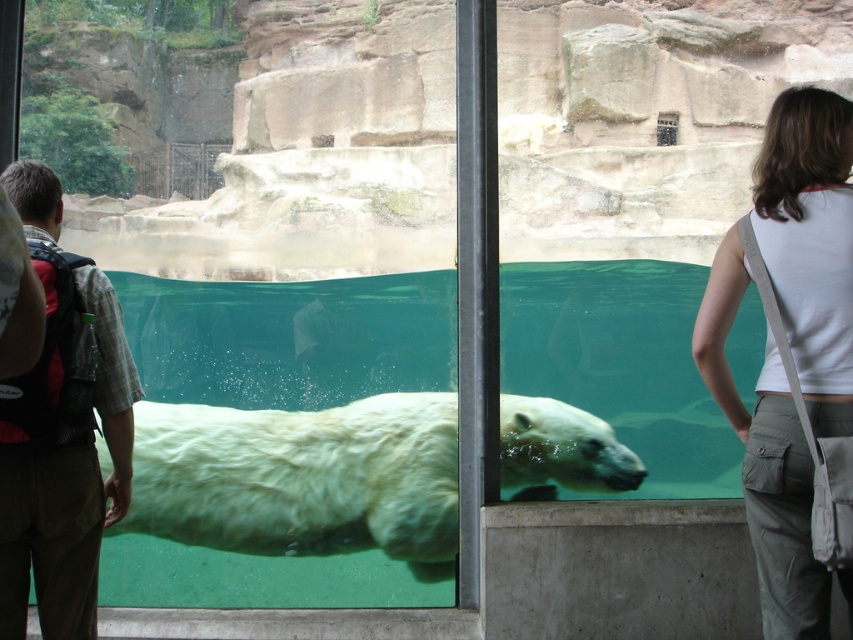
Is white fluffy polar bear at center taller than plaid shirt at left?

Indeed, white fluffy polar bear at center has a greater height compared to plaid shirt at left.

Locate an element on the screen. The height and width of the screenshot is (640, 853). white fluffy polar bear at center is located at coordinates (302, 480).

Find the location of a particular element. The height and width of the screenshot is (640, 853). white fluffy polar bear at center is located at coordinates (302, 480).

Between point (183, 500) and point (840, 378), which one is positioned behind?

Positioned behind is point (183, 500).

Between point (144, 518) and point (799, 212), which one is positioned in front?

Point (799, 212) is more forward.

Where is `white fluffy polar bear at center`? The height and width of the screenshot is (640, 853). white fluffy polar bear at center is located at coordinates (302, 480).

Which is in front, point (772, 266) or point (85, 529)?

Point (772, 266)

Is point (821, 262) farther from viewer compared to point (97, 531)?

No, it is not.

Which is in front, point (798, 458) or point (74, 561)?

Positioned in front is point (798, 458).

Identify the location of white cotton tank top at right. (810, 243).